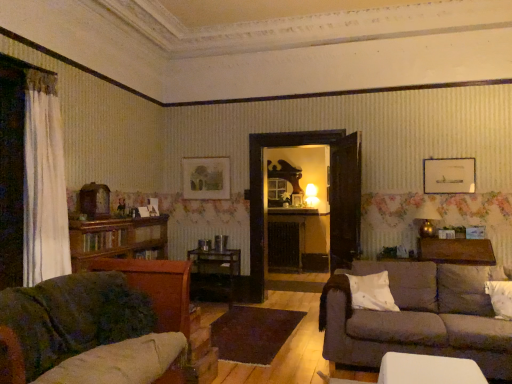
Question: From a real-world perspective, is velvet green couch at lower left, which is the first studio couch from front to back, physically located above or below wooden glossy table at center, the second table in the top-to-bottom sequence?

Choices:
 (A) below
 (B) above

Answer: (B)

Question: In terms of width, does velvet green couch at lower left, arranged as the first studio couch when viewed from the left, look wider or thinner when compared to wooden glossy table at center, which is the first table in left-to-right order?

Choices:
 (A) wide
 (B) thin

Answer: (A)

Question: Which of these objects is positioned farthest from the white matte pillow at center, the second pillow positioned from the right?

Choices:
 (A) dark brown fabric couch at lower right, arranged as the 1th studio couch when viewed from the back
 (B) white fabric pillow at lower right, the 1th pillow viewed from the right
 (C) matte wooden picture frame at upper center, arranged as the 1th picture frame when viewed from the back
 (D) matte white picture frame at upper right, which is the 1th picture frame in right-to-left order
 (E) velvet green couch at lower left, which is the first studio couch from front to back

Answer: (C)

Question: Based on their relative distances, which object is nearer to the white matte pillow at center, the second pillow positioned from the right?

Choices:
 (A) brown wood table at right, arranged as the second table when ordered from the bottom
 (B) velvet green couch at lower left, which is the first studio couch from front to back
 (C) brown wooden bookcase at left
 (D) white fabric pillow at lower right, the 1th pillow viewed from the right
 (E) dark brown fabric couch at lower right, the 2th studio couch when ordered from left to right

Answer: (E)